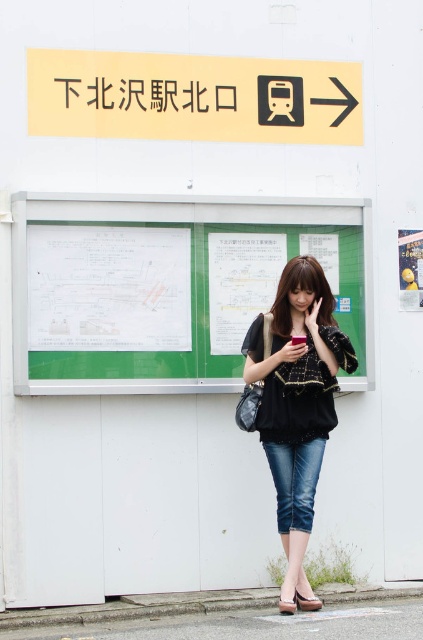
Is green matte bulletin board at center positioned at the back of leather sandal at lower center?

Yes, it is behind leather sandal at lower center.

This screenshot has width=423, height=640. Describe the element at coordinates (169, 285) in the screenshot. I see `green matte bulletin board at center` at that location.

Where is `green matte bulletin board at center`? This screenshot has height=640, width=423. green matte bulletin board at center is located at coordinates (169, 285).

Does white paper poster at right have a greater height compared to matte brown sandal at lower center?

Correct, white paper poster at right is much taller as matte brown sandal at lower center.

Is point (414, 291) positioned before point (301, 605)?

No.

Locate an element on the screen. This screenshot has width=423, height=640. white paper poster at right is located at coordinates tap(409, 268).

Who is more forward, [412,250] or [280,611]?

Point [280,611]

Is point (417, 237) closer to viewer compared to point (293, 611)?

No, it is not.

I want to click on white paper poster at right, so click(409, 268).